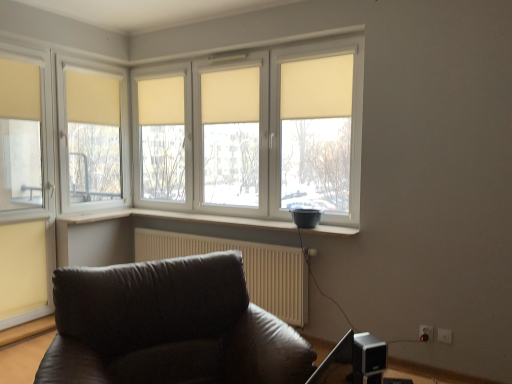
Question: Does beige fabric curtain at upper left, which is the 4th curtain from right to left, have a smaller size compared to beige fabric curtain at center, the 3th curtain when ordered from right to left?

Choices:
 (A) no
 (B) yes

Answer: (B)

Question: Does beige fabric curtain at upper left, which is the 4th curtain from right to left, turn towards beige fabric curtain at center, the 3th curtain when ordered from right to left?

Choices:
 (A) yes
 (B) no

Answer: (A)

Question: From the image's perspective, is beige fabric curtain at upper left, the second curtain in the left-to-right sequence, under beige fabric curtain at center, which is the third curtain in left-to-right order?

Choices:
 (A) yes
 (B) no

Answer: (A)

Question: Is the depth of beige fabric curtain at upper left, the second curtain in the left-to-right sequence, greater than that of beige fabric curtain at center, the 3th curtain when ordered from right to left?

Choices:
 (A) no
 (B) yes

Answer: (A)

Question: Does beige fabric curtain at upper left, which is the 4th curtain from right to left, appear on the left side of beige fabric curtain at center, the 3th curtain when ordered from right to left?

Choices:
 (A) yes
 (B) no

Answer: (A)

Question: Is beige fabric curtain at upper left, the second curtain in the left-to-right sequence, next to beige fabric curtain at center, which is the third curtain in left-to-right order, and touching it?

Choices:
 (A) no
 (B) yes

Answer: (A)

Question: Is metallic silver speaker at lower right at the right side of white plastic electric outlet at lower right, which ranks as the 1th electric outlet in left-to-right order?

Choices:
 (A) no
 (B) yes

Answer: (A)

Question: Is metallic silver speaker at lower right looking in the opposite direction of white plastic electric outlet at lower right, the second electric outlet when ordered from right to left?

Choices:
 (A) yes
 (B) no

Answer: (B)

Question: Is metallic silver speaker at lower right outside of white plastic electric outlet at lower right, which ranks as the 1th electric outlet in left-to-right order?

Choices:
 (A) no
 (B) yes

Answer: (B)

Question: Does metallic silver speaker at lower right have a lesser width compared to white plastic electric outlet at lower right, the second electric outlet when ordered from right to left?

Choices:
 (A) yes
 (B) no

Answer: (B)

Question: From the image's perspective, is metallic silver speaker at lower right on white plastic electric outlet at lower right, the second electric outlet when ordered from right to left?

Choices:
 (A) yes
 (B) no

Answer: (A)

Question: Does metallic silver speaker at lower right appear on the left side of white plastic electric outlet at lower right, which ranks as the 1th electric outlet in left-to-right order?

Choices:
 (A) no
 (B) yes

Answer: (B)

Question: From a real-world perspective, is white textured radiator at lower center beneath beige fabric curtain at center, which is counted as the second curtain, starting from the right?

Choices:
 (A) no
 (B) yes

Answer: (B)